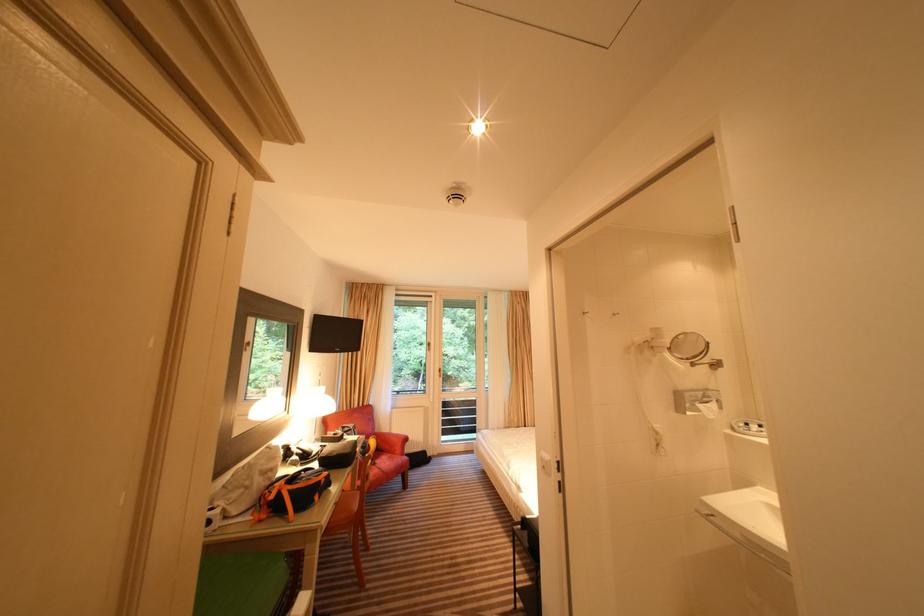
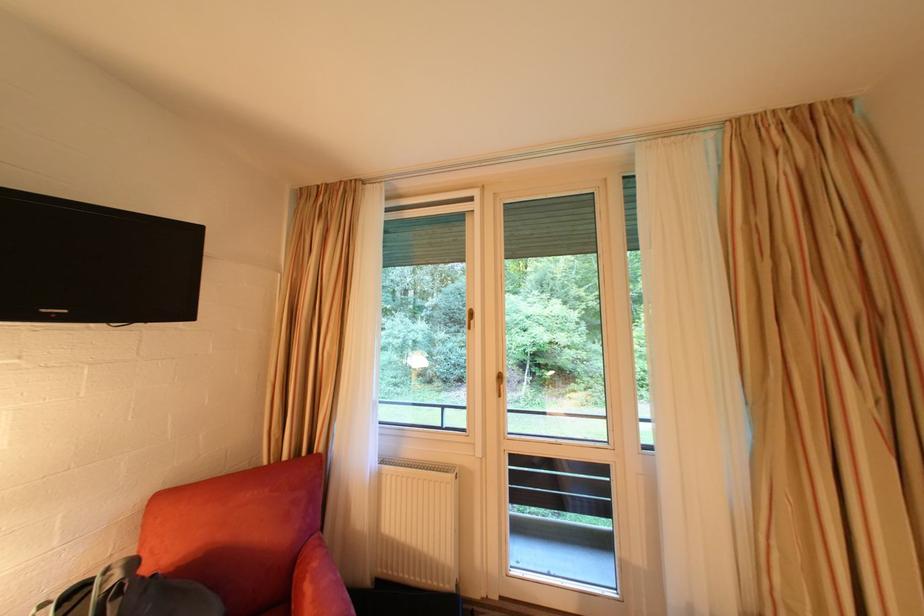
Question: Which direction would the cameraman need to move to produce the second image? Reply with the corresponding letter.

Choices:
 (A) Left
 (B) Right
 (C) Forward
 (D) Backward

Answer: (C)